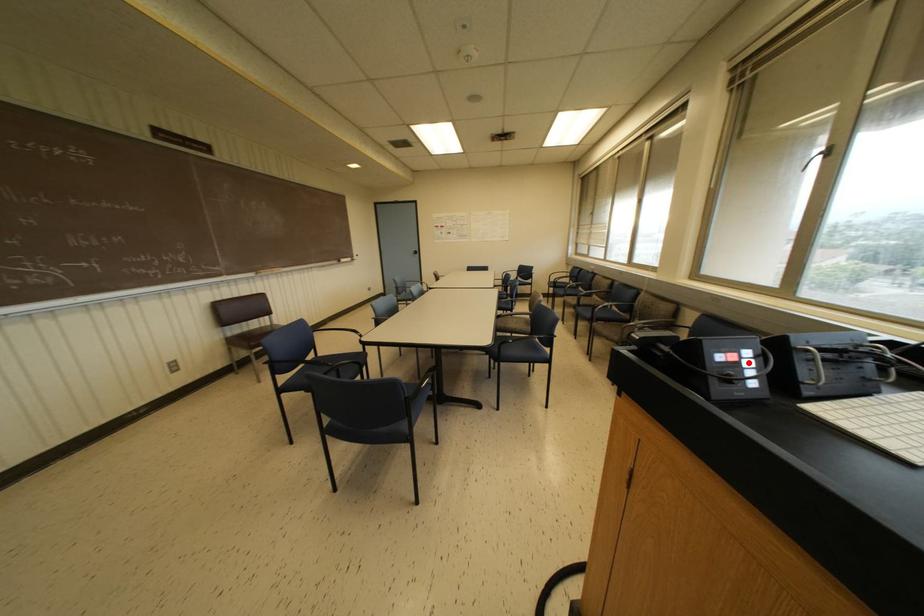
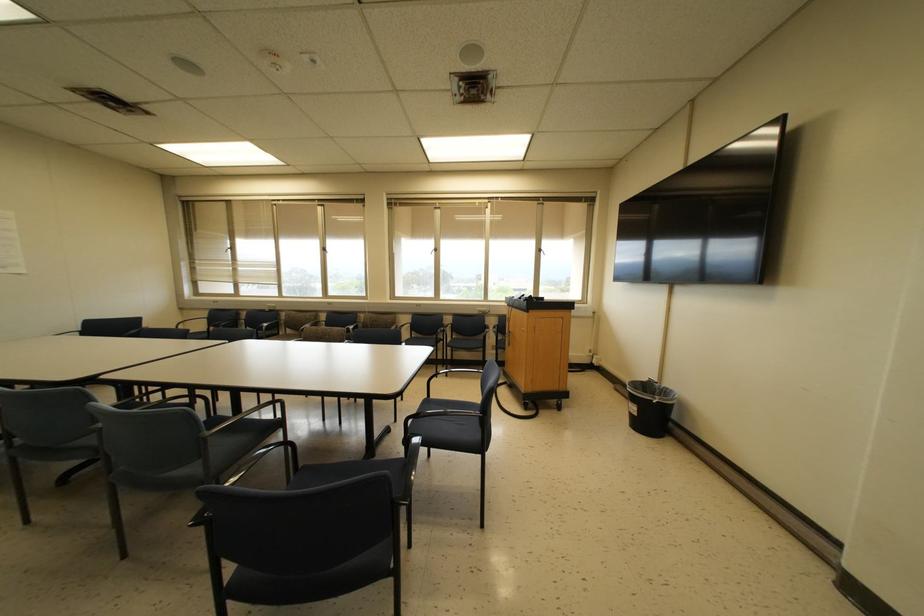
Question: I am providing you with two images of the same scene from different viewpoints. A red point is marked on the first image. At the location where the point appears in image 1, is it still visible in image 2?

Choices:
 (A) Yes
 (B) No

Answer: (B)